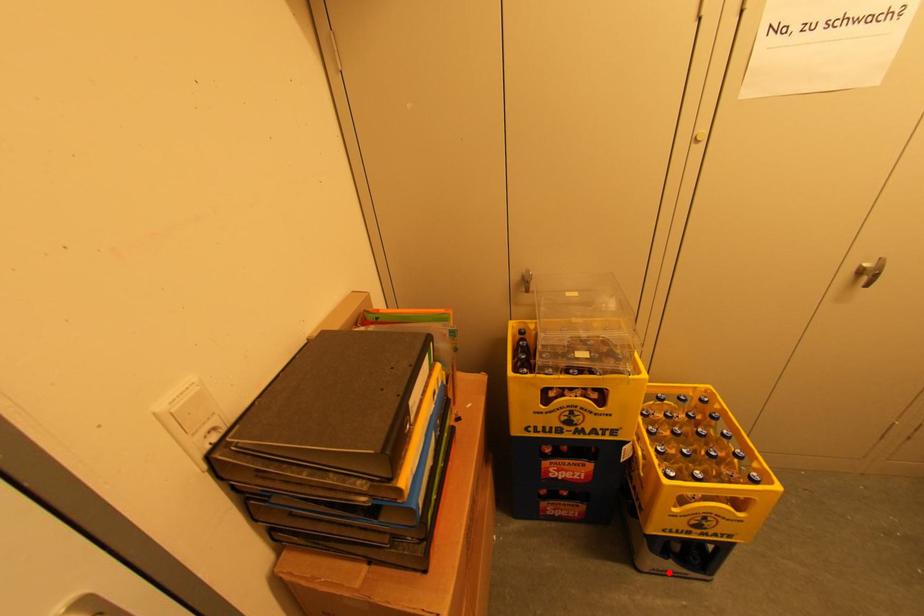
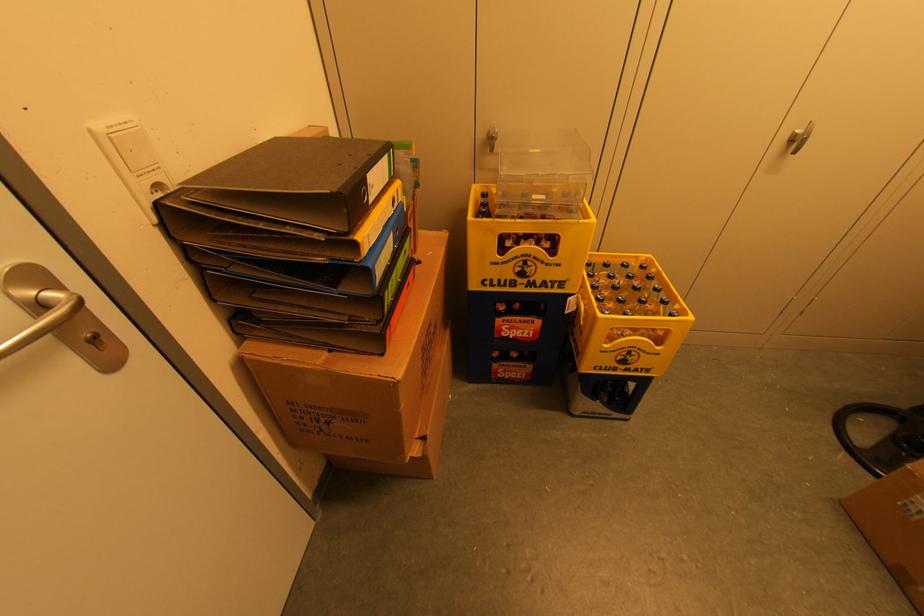
Question: I am providing you with two images of the same scene from different viewpoints. Given a red point in image1, look at the same physical point in image2. Is it:

Choices:
 (A) Closer to the viewpoint
 (B) Farther from the viewpoint

Answer: (B)